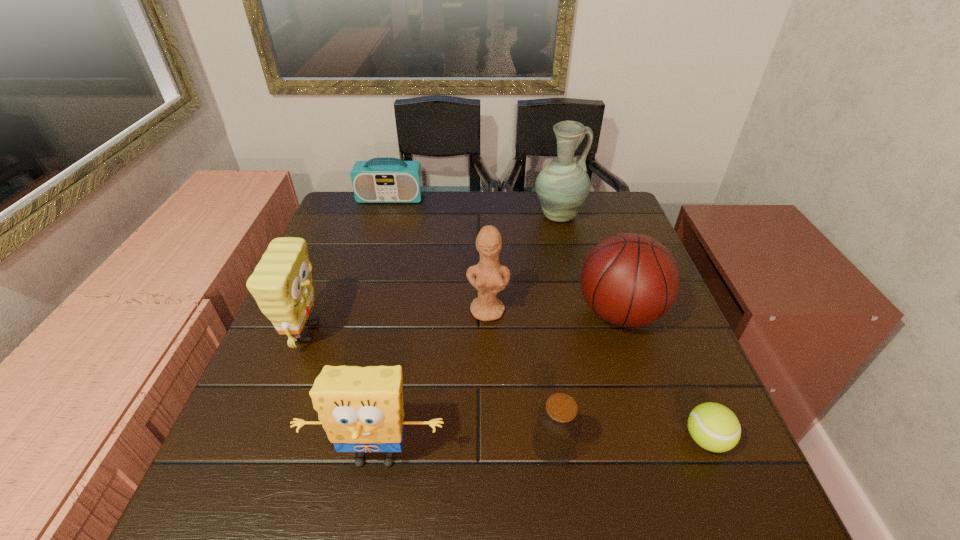
I want to click on free space at the near left corner of the desktop, so click(x=291, y=523).

Identify the location of vacant space at the far right corner of the desktop. (615, 231).

What are the coordinates of `free space at the near right corner of the desktop` in the screenshot? It's located at (732, 518).

The height and width of the screenshot is (540, 960). Find the location of `free spot between the fifth object from right to left and the farther sponge`. free spot between the fifth object from right to left and the farther sponge is located at coordinates (397, 322).

The width and height of the screenshot is (960, 540). Identify the location of free spot between the radio receiver and the basketball. (505, 255).

This screenshot has height=540, width=960. What are the coordinates of `free space between the jar and the figurine` in the screenshot? It's located at (521, 378).

Find the location of `vacant area that lies between the tennis ball and the jar`. vacant area that lies between the tennis ball and the jar is located at coordinates (630, 442).

This screenshot has width=960, height=540. In order to click on free spot between the basketball and the figurine in this screenshot , I will do `click(554, 312)`.

Image resolution: width=960 pixels, height=540 pixels. I want to click on vacant space in between the left sponge and the tennis ball, so click(x=507, y=386).

Identify the location of free space between the right sponge and the fourth object from left to right. Image resolution: width=960 pixels, height=540 pixels. (432, 384).